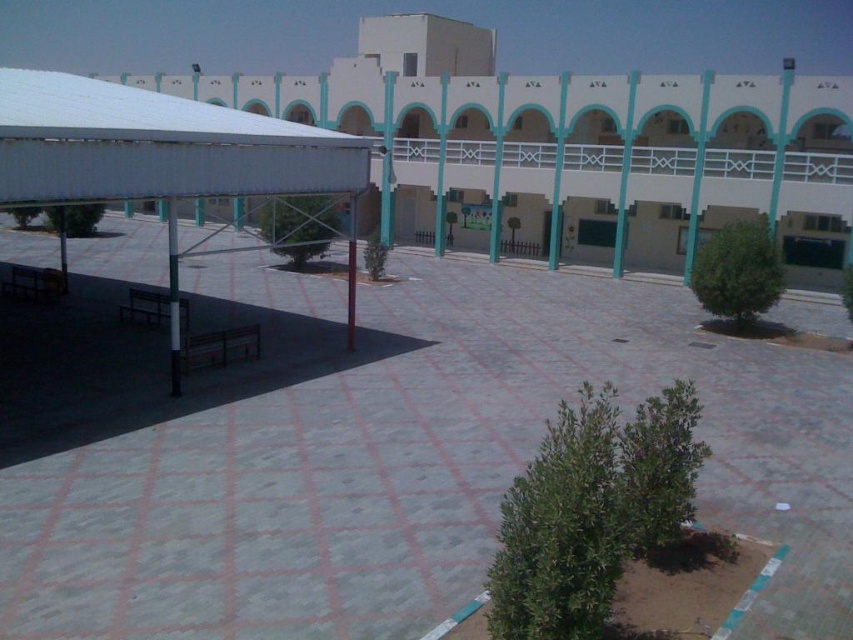
Question: Which point is closer to the camera?

Choices:
 (A) white matte canopy at upper left
 (B) gray concrete courtyard at center

Answer: (B)

Question: Is gray concrete courtyard at center to the left of white matte canopy at upper left from the viewer's perspective?

Choices:
 (A) yes
 (B) no

Answer: (B)

Question: Among these points, which one is farthest from the camera?

Choices:
 (A) (103, 140)
 (B) (473, 579)

Answer: (A)

Question: Does gray concrete courtyard at center appear over white matte canopy at upper left?

Choices:
 (A) yes
 (B) no

Answer: (B)

Question: Is gray concrete courtyard at center wider than white matte canopy at upper left?

Choices:
 (A) no
 (B) yes

Answer: (B)